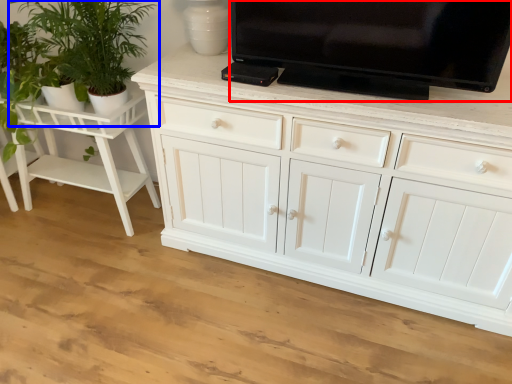
Question: Which of the following is the farthest to the observer, television (highlighted by a red box) or houseplant (highlighted by a blue box)?

Choices:
 (A) television
 (B) houseplant

Answer: (B)